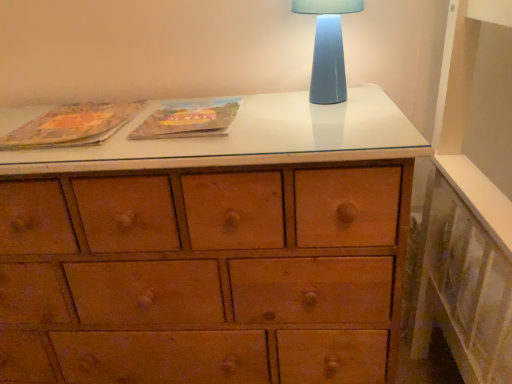
Describe the element at coordinates (188, 119) in the screenshot. The width and height of the screenshot is (512, 384). I see `matte cardboard book at center, marked as the first paperback book in a right-to-left arrangement` at that location.

Find the location of `matte cardboard book at center, marked as the first paperback book in a right-to-left arrangement`. matte cardboard book at center, marked as the first paperback book in a right-to-left arrangement is located at coordinates (188, 119).

Do you think matte cardboard book at center, marked as the second paperback book in a left-to-right arrangement, is within blue ceramic table lamp at upper right, or outside of it?

The correct answer is: outside.

Is matte cardboard book at center, marked as the second paperback book in a left-to-right arrangement, to the left of blue ceramic table lamp at upper right from the viewer's perspective?

Yes.

From a real-world perspective, between matte cardboard book at center, marked as the second paperback book in a left-to-right arrangement, and blue ceramic table lamp at upper right, who is vertically lower?

In real-world perspective, matte cardboard book at center, marked as the second paperback book in a left-to-right arrangement, is lower.

Considering the relative positions of matte paper book at upper left, placed as the second paperback book when sorted from right to left, and matte cardboard book at center, marked as the second paperback book in a left-to-right arrangement, in the image provided, is matte paper book at upper left, placed as the second paperback book when sorted from right to left, to the left or to the right of matte cardboard book at center, marked as the second paperback book in a left-to-right arrangement,?

matte paper book at upper left, placed as the second paperback book when sorted from right to left, is to the left of matte cardboard book at center, marked as the second paperback book in a left-to-right arrangement.

Looking at this image, which is behind, matte paper book at upper left, marked as the first paperback book in a left-to-right arrangement, or matte cardboard book at center, marked as the second paperback book in a left-to-right arrangement?

matte cardboard book at center, marked as the second paperback book in a left-to-right arrangement, is more distant.

From the picture: What's the angular difference between matte paper book at upper left, marked as the first paperback book in a left-to-right arrangement, and matte cardboard book at center, marked as the first paperback book in a right-to-left arrangement,'s facing directions?

They differ by 0.000844 degrees in their facing directions.

Is point (45, 138) less distant than point (164, 104)?

Yes, it is in front of point (164, 104).

From the image's perspective, who appears lower, blue ceramic table lamp at upper right or matte paper book at upper left, placed as the second paperback book when sorted from right to left?

matte paper book at upper left, placed as the second paperback book when sorted from right to left, from the image's perspective.

From a real-world perspective, who is located higher, blue ceramic table lamp at upper right or matte paper book at upper left, marked as the first paperback book in a left-to-right arrangement?

In real-world perspective, blue ceramic table lamp at upper right is above.

Considering the sizes of blue ceramic table lamp at upper right and matte paper book at upper left, placed as the second paperback book when sorted from right to left, in the image, is blue ceramic table lamp at upper right wider or thinner than matte paper book at upper left, placed as the second paperback book when sorted from right to left,?

In the image, blue ceramic table lamp at upper right appears to be more narrow than matte paper book at upper left, placed as the second paperback book when sorted from right to left.

Is the depth of blue ceramic table lamp at upper right greater than that of matte paper book at upper left, placed as the second paperback book when sorted from right to left?

Yes, blue ceramic table lamp at upper right is further from the viewer.

I want to click on the 2nd paperback book in front of the blue ceramic table lamp at upper right, starting your count from the anchor, so click(x=72, y=125).

Is blue ceramic table lamp at upper right completely or partially inside matte paper book at upper left, placed as the second paperback book when sorted from right to left?

No, blue ceramic table lamp at upper right is located outside of matte paper book at upper left, placed as the second paperback book when sorted from right to left.

Which of these two, matte paper book at upper left, marked as the first paperback book in a left-to-right arrangement, or blue ceramic table lamp at upper right, is smaller?

Smaller between the two is matte paper book at upper left, marked as the first paperback book in a left-to-right arrangement.

Is matte cardboard book at center, marked as the second paperback book in a left-to-right arrangement, positioned with its back to matte paper book at upper left, placed as the second paperback book when sorted from right to left?

That's not correct — matte cardboard book at center, marked as the second paperback book in a left-to-right arrangement, is not looking away from matte paper book at upper left, placed as the second paperback book when sorted from right to left.

From the image's perspective, is matte cardboard book at center, marked as the second paperback book in a left-to-right arrangement, on top of matte paper book at upper left, marked as the first paperback book in a left-to-right arrangement?

No, from the image's perspective, matte cardboard book at center, marked as the second paperback book in a left-to-right arrangement, is not over matte paper book at upper left, marked as the first paperback book in a left-to-right arrangement.

Considering the relative sizes of matte cardboard book at center, marked as the first paperback book in a right-to-left arrangement, and matte paper book at upper left, marked as the first paperback book in a left-to-right arrangement, in the image provided, is matte cardboard book at center, marked as the first paperback book in a right-to-left arrangement, taller than matte paper book at upper left, marked as the first paperback book in a left-to-right arrangement,?

No, matte cardboard book at center, marked as the first paperback book in a right-to-left arrangement, is not taller than matte paper book at upper left, marked as the first paperback book in a left-to-right arrangement.

From the image's perspective, who appears lower, blue ceramic table lamp at upper right or matte cardboard book at center, marked as the first paperback book in a right-to-left arrangement?

From the image's view, matte cardboard book at center, marked as the first paperback book in a right-to-left arrangement, is below.

From a real-world perspective, relative to matte cardboard book at center, marked as the second paperback book in a left-to-right arrangement, is blue ceramic table lamp at upper right vertically above or below?

blue ceramic table lamp at upper right is situated higher than matte cardboard book at center, marked as the second paperback book in a left-to-right arrangement, in the real world.

Is blue ceramic table lamp at upper right not near matte cardboard book at center, marked as the second paperback book in a left-to-right arrangement?

No, blue ceramic table lamp at upper right is not far from matte cardboard book at center, marked as the second paperback book in a left-to-right arrangement.

How many degrees apart are the facing directions of blue ceramic table lamp at upper right and matte cardboard book at center, marked as the second paperback book in a left-to-right arrangement?

The angular difference between blue ceramic table lamp at upper right and matte cardboard book at center, marked as the second paperback book in a left-to-right arrangement, is 0.000259 degrees.

Locate an element on the screen. The height and width of the screenshot is (384, 512). the 1st paperback book in front of the blue ceramic table lamp at upper right, counting from the anchor's position is located at coordinates (188, 119).

This screenshot has height=384, width=512. What are the coordinates of `paperback book that is above the matte cardboard book at center, marked as the second paperback book in a left-to-right arrangement (from the image's perspective)` in the screenshot? It's located at (72, 125).

From the picture: From the image, which object appears to be nearer to blue ceramic table lamp at upper right, matte paper book at upper left, marked as the first paperback book in a left-to-right arrangement, or matte cardboard book at center, marked as the first paperback book in a right-to-left arrangement?

Among the two, matte cardboard book at center, marked as the first paperback book in a right-to-left arrangement, is located nearer to blue ceramic table lamp at upper right.

When comparing their distances from matte cardboard book at center, marked as the first paperback book in a right-to-left arrangement, does blue ceramic table lamp at upper right or matte paper book at upper left, marked as the first paperback book in a left-to-right arrangement, seem closer?

matte paper book at upper left, marked as the first paperback book in a left-to-right arrangement, is closer to matte cardboard book at center, marked as the first paperback book in a right-to-left arrangement.

Estimate the real-world distances between objects in this image. Which object is closer to matte cardboard book at center, marked as the first paperback book in a right-to-left arrangement, matte paper book at upper left, placed as the second paperback book when sorted from right to left, or blue ceramic table lamp at upper right?

matte paper book at upper left, placed as the second paperback book when sorted from right to left.

From the image, which object appears to be farther from matte paper book at upper left, placed as the second paperback book when sorted from right to left, matte cardboard book at center, marked as the second paperback book in a left-to-right arrangement, or blue ceramic table lamp at upper right?

blue ceramic table lamp at upper right is positioned further to the anchor matte paper book at upper left, placed as the second paperback book when sorted from right to left.

Looking at the image, which one is located closer to matte paper book at upper left, placed as the second paperback book when sorted from right to left, blue ceramic table lamp at upper right or matte cardboard book at center, marked as the second paperback book in a left-to-right arrangement?

The object closer to matte paper book at upper left, placed as the second paperback book when sorted from right to left, is matte cardboard book at center, marked as the second paperback book in a left-to-right arrangement.

Based on their spatial positions, is matte cardboard book at center, marked as the first paperback book in a right-to-left arrangement, or matte paper book at upper left, marked as the first paperback book in a left-to-right arrangement, closer to blue ceramic table lamp at upper right?

Among the two, matte cardboard book at center, marked as the first paperback book in a right-to-left arrangement, is located nearer to blue ceramic table lamp at upper right.

You are a GUI agent. You are given a task and a screenshot of the screen. Output one action in this format:
    pyautogui.click(x=<x>, y=<y>)
    Task: Click on the paperback book between matte paper book at upper left, placed as the second paperback book when sorted from right to left, and blue ceramic table lamp at upper right, in the horizontal direction
    The image size is (512, 384).
    Given the screenshot: What is the action you would take?
    pyautogui.click(x=188, y=119)